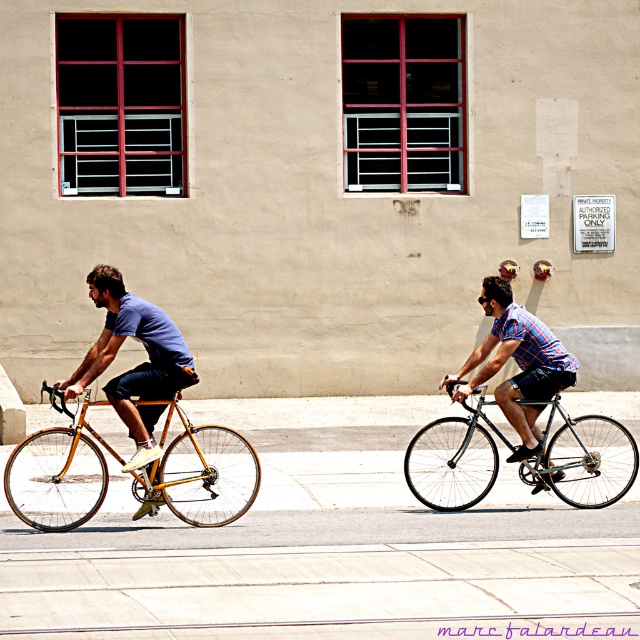
Between gold metallic bicycle at left and matte gold bicycle at left, which one is positioned lower?

Positioned lower is gold metallic bicycle at left.

Consider the image. Measure the distance between gold metallic bicycle at left and camera.

gold metallic bicycle at left and camera are 12.20 meters apart.

Between point (236, 451) and point (168, 339), which one is positioned behind?

Point (236, 451)

I want to click on gold metallic bicycle at left, so click(x=58, y=472).

Is gold metallic bicycle at left shorter than shiny silver bicycle at right?

No.

Can you confirm if gold metallic bicycle at left is positioned to the left of shiny silver bicycle at right?

Yes, gold metallic bicycle at left is to the left of shiny silver bicycle at right.

The width and height of the screenshot is (640, 640). Describe the element at coordinates (58, 472) in the screenshot. I see `gold metallic bicycle at left` at that location.

I want to click on gold metallic bicycle at left, so click(x=58, y=472).

Does shiny silver bicycle at right appear on the left side of matte gold bicycle at left?

No, shiny silver bicycle at right is not to the left of matte gold bicycle at left.

What are the coordinates of `shiny silver bicycle at right` in the screenshot? It's located at (582, 458).